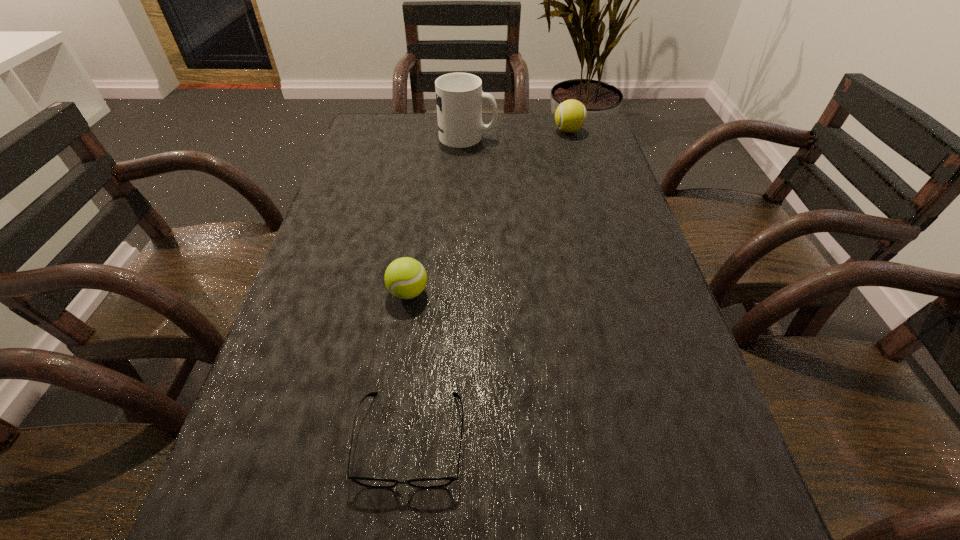
In order to click on free space between the second nearest object and the rightmost object in this screenshot , I will do `click(489, 212)`.

I want to click on vacant area between the third farthest object and the spectacles, so click(x=409, y=366).

Locate an element on the screen. The image size is (960, 540). unoccupied area between the nearest object and the third farthest object is located at coordinates (409, 366).

The height and width of the screenshot is (540, 960). I want to click on vacant area between the tallest object and the nearest object, so click(x=439, y=288).

Locate an element on the screen. Image resolution: width=960 pixels, height=540 pixels. empty space that is in between the tallest object and the farther tennis ball is located at coordinates (518, 134).

The image size is (960, 540). In order to click on free space that is in between the farther tennis ball and the nearest object in this screenshot , I will do (490, 285).

Where is `free spot between the spectacles and the second nearest object`? Image resolution: width=960 pixels, height=540 pixels. free spot between the spectacles and the second nearest object is located at coordinates (409, 366).

The height and width of the screenshot is (540, 960). What are the coordinates of `free space between the mug and the nearer tennis ball` in the screenshot? It's located at (438, 214).

The image size is (960, 540). I want to click on vacant area that lies between the nearer tennis ball and the nearest object, so click(409, 366).

Locate which object ranks in proximity to the tallest object. Please provide its 2D coordinates. Your answer should be formatted as a tuple, i.e. [(x, y)], where the tuple contains the x and y coordinates of a point satisfying the conditions above.

[(570, 116)]